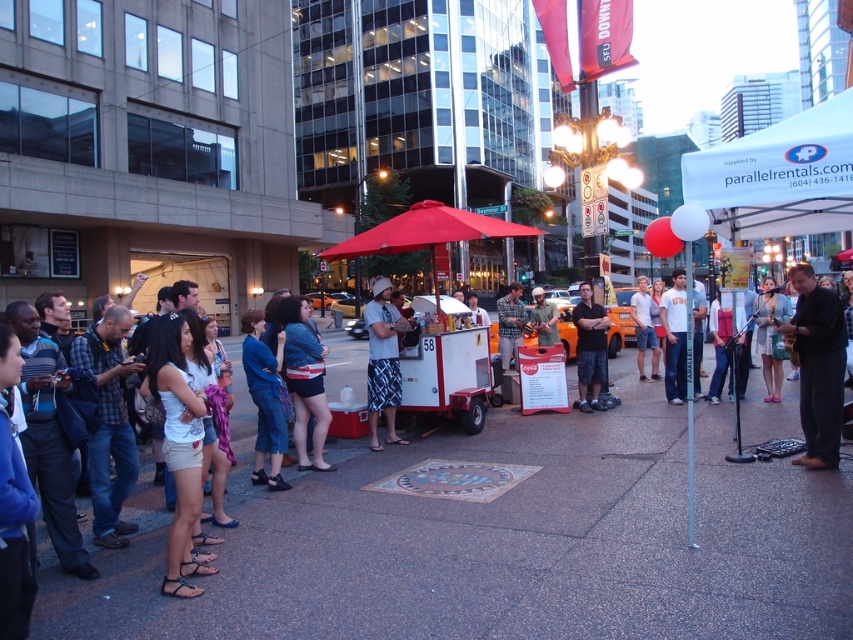
Question: Among these objects, which one is nearest to the camera?

Choices:
 (A) black smooth suit at right
 (B) white cotton t-shirt at center
 (C) dark blue shorts at center

Answer: (A)

Question: Considering the relative positions of black smooth suit at right and dark blue shorts at center in the image provided, where is black smooth suit at right located with respect to dark blue shorts at center?

Choices:
 (A) above
 (B) below

Answer: (A)

Question: Is black smooth suit at right above white cotton t-shirt at center?

Choices:
 (A) no
 (B) yes

Answer: (A)

Question: From the image, what is the correct spatial relationship of black smooth suit at right in relation to dark blue shorts at center?

Choices:
 (A) right
 (B) left

Answer: (A)

Question: Based on their relative distances, which object is farther from the white cotton t-shirt at center?

Choices:
 (A) dark blue shorts at center
 (B) black smooth suit at right

Answer: (B)

Question: Which is nearer to the black smooth suit at right?

Choices:
 (A) white cotton t-shirt at center
 (B) dark blue shorts at center

Answer: (B)